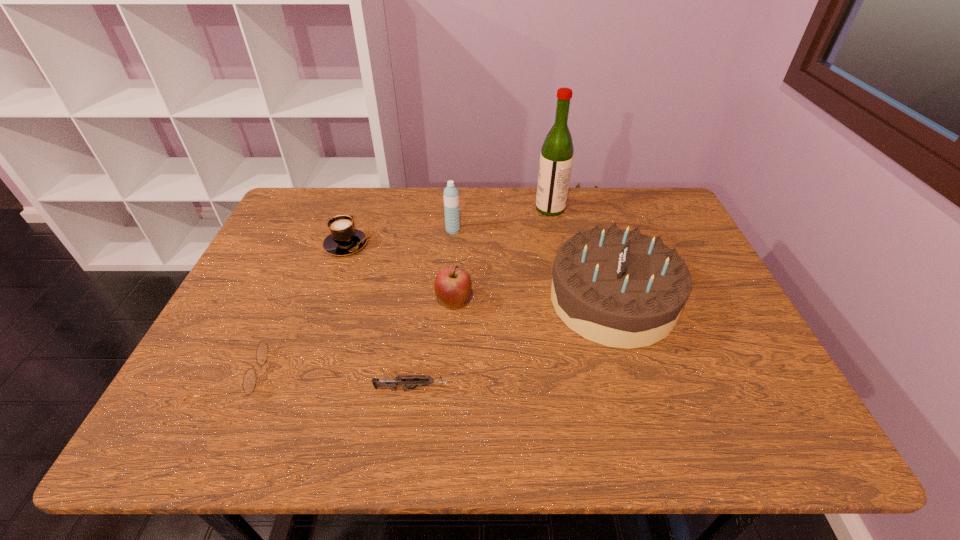
At what (x,y) coordinates should I click in order to perform the action: click on the tallest object. Please return your answer as a coordinate pair (x, y). Image resolution: width=960 pixels, height=540 pixels. Looking at the image, I should click on (556, 158).

Image resolution: width=960 pixels, height=540 pixels. I want to click on liquor, so click(x=556, y=158).

Image resolution: width=960 pixels, height=540 pixels. I want to click on water bottle, so click(x=451, y=194).

The image size is (960, 540). I want to click on birthday cake, so click(618, 288).

Identify the location of apple. (452, 286).

Find the location of a particular element. the second object from left to right is located at coordinates (344, 239).

This screenshot has width=960, height=540. In order to click on the third shortest object in this screenshot , I will do `click(344, 239)`.

The width and height of the screenshot is (960, 540). What are the coordinates of `the leftmost object` in the screenshot? It's located at (249, 381).

Where is `gun`? gun is located at coordinates 407,380.

Find the location of `vacant space located on the label of the liquor`. vacant space located on the label of the liquor is located at coordinates (501, 208).